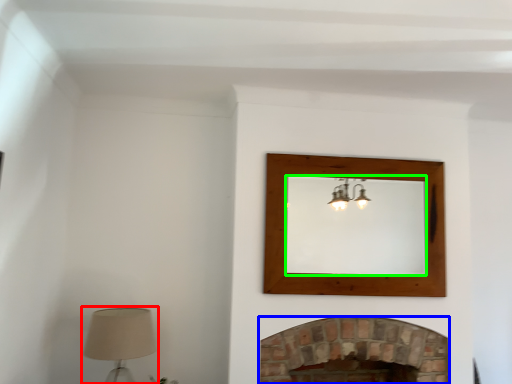
Question: Which is nearer to the table lamp (highlighted by a red box)? fireplace (highlighted by a blue box) or mirror (highlighted by a green box).

Choices:
 (A) fireplace
 (B) mirror

Answer: (A)